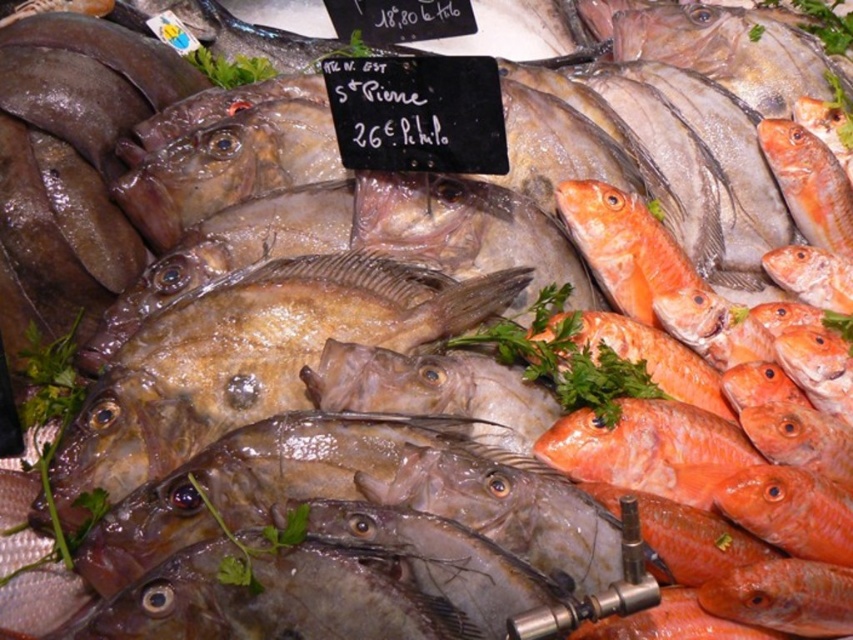
Question: Does shiny orange fish at center appear on the left side of green leafy parsley at center?

Choices:
 (A) no
 (B) yes

Answer: (A)

Question: Does shiny orange fish at center appear under green leafy parsley at center?

Choices:
 (A) no
 (B) yes

Answer: (A)

Question: Does shiny orange fish at center lie in front of green leafy parsley at center?

Choices:
 (A) no
 (B) yes

Answer: (A)

Question: Which object is closer to the camera taking this photo?

Choices:
 (A) shiny orange fish at center
 (B) green leafy parsley at center

Answer: (B)